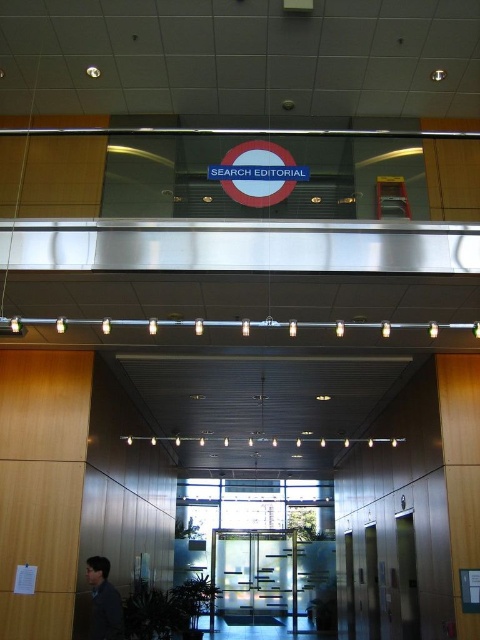
You are standing in the elevator lobby and want to exit through the transparent glass doors at center. There is a dark gray jacket at lower left on the floor. Can you step over the jacket to reach the doors?

The transparent glass doors at center are further to the viewer than the dark gray jacket at lower left, meaning the doors are closer to you. Therefore, you can easily step over the dark gray jacket at lower left to reach the doors since they are in front of you.

In the scene shown: You are a delivery person carrying a large package that is 1.2 meters wide. You need to enter the elevator through the transparent glass doors at center. Considering the dark gray jacket at lower left is 0.5 meters wide, will your package fit through the doors?

The transparent glass doors at center are wider than the dark gray jacket at lower left. Since the jacket is 0.5 meters wide, the doors are wider than that. The package is 1.2 meters wide, so if the doors are wider than 1.2 meters, it would fit. However, the exact width isn